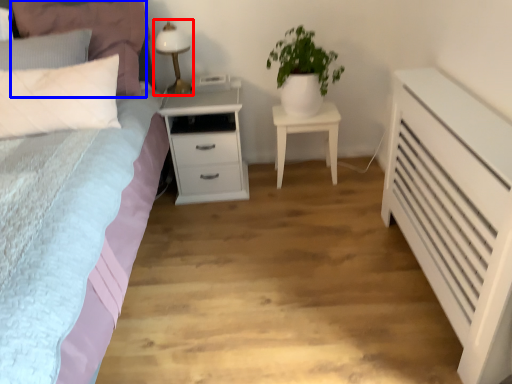
Question: Which point is further to the camera, bedside lamp (highlighted by a red box) or pillow (highlighted by a blue box)?

Choices:
 (A) bedside lamp
 (B) pillow

Answer: (A)